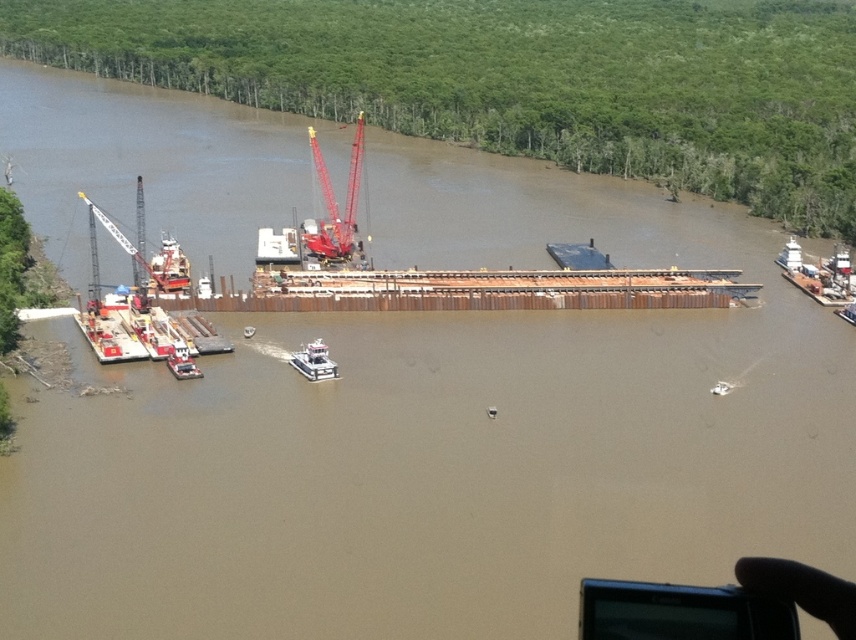
You are a construction supervisor overseeing the site from a helicopter. You need to ensure that the metallic gray barge at lower left stays at least 200 meters away from the construction site to avoid interference with ongoing operations. Based on the current distance, is the barge compliant with this safety requirement?

The metallic gray barge at lower left is currently 179.62 meters away from the camera, which is less than the required 200 meters. Therefore, the barge is not compliant with the safety requirement and needs to move further away.

You are a construction supervisor planning to move a 180 meter long steel beam from the point at coordinate (96, 346) to the other end of the construction site. Can the beam be placed without bending or overlapping any existing structures?

The distance between the two points is 183.63 meters, which is slightly longer than the beam. The beam can be placed without bending or overlapping since it is 3.63 meters shorter than the available space.

You are a construction supervisor checking the river traffic. You need to ensure that the white plastic boat at center can pass under the metallic gray barge at lower left. Based on their heights, is this possible?

The metallic gray barge at lower left is much taller than the white plastic boat at center, so the white plastic boat at center can pass under the metallic gray barge at lower left.